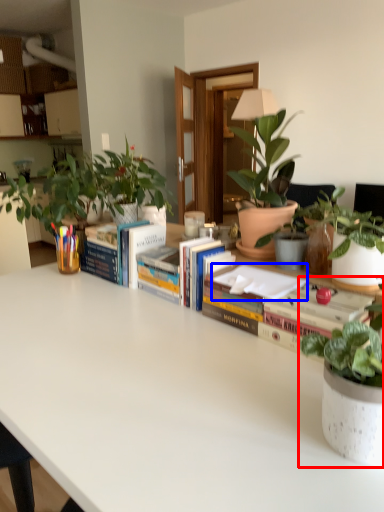
Question: Which point is closer to the camera, houseplant (highlighted by a red box) or paperback book (highlighted by a blue box)?

Choices:
 (A) houseplant
 (B) paperback book

Answer: (A)